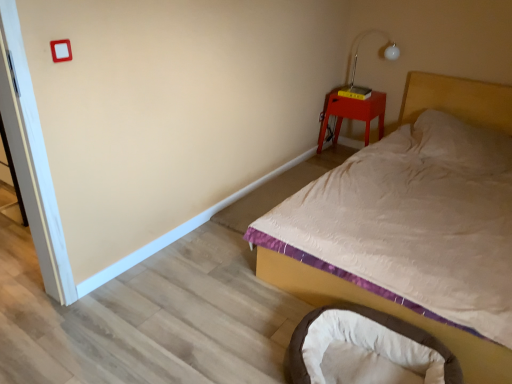
Question: From the image's perspective, is metallic silver table lamp at upper right on matte red wooden nightstand at upper right?

Choices:
 (A) no
 (B) yes

Answer: (B)

Question: From a real-world perspective, is metallic silver table lamp at upper right below matte red wooden nightstand at upper right?

Choices:
 (A) no
 (B) yes

Answer: (A)

Question: Does metallic silver table lamp at upper right have a smaller size compared to matte red wooden nightstand at upper right?

Choices:
 (A) yes
 (B) no

Answer: (A)

Question: Is metallic silver table lamp at upper right positioned in front of matte red wooden nightstand at upper right?

Choices:
 (A) yes
 (B) no

Answer: (A)

Question: Can you confirm if metallic silver table lamp at upper right is taller than matte red wooden nightstand at upper right?

Choices:
 (A) yes
 (B) no

Answer: (B)

Question: Is metallic silver table lamp at upper right taller or shorter than white quilted fabric bed at upper right?

Choices:
 (A) short
 (B) tall

Answer: (A)

Question: Does point (379, 33) appear closer or farther from the camera than point (501, 122)?

Choices:
 (A) closer
 (B) farther

Answer: (B)

Question: From a real-world perspective, is metallic silver table lamp at upper right physically located above or below white quilted fabric bed at upper right?

Choices:
 (A) below
 (B) above

Answer: (B)

Question: Would you say metallic silver table lamp at upper right is inside or outside white quilted fabric bed at upper right?

Choices:
 (A) outside
 (B) inside

Answer: (A)

Question: Is brown plush infant bed at lower right situated inside white quilted fabric bed at upper right or outside?

Choices:
 (A) outside
 (B) inside

Answer: (A)

Question: From the image's perspective, is brown plush infant bed at lower right positioned above or below white quilted fabric bed at upper right?

Choices:
 (A) above
 (B) below

Answer: (B)

Question: In terms of width, does brown plush infant bed at lower right look wider or thinner when compared to white quilted fabric bed at upper right?

Choices:
 (A) thin
 (B) wide

Answer: (A)

Question: Is brown plush infant bed at lower right in front of or behind white quilted fabric bed at upper right in the image?

Choices:
 (A) behind
 (B) front

Answer: (B)

Question: In terms of height, does matte red wooden nightstand at upper right look taller or shorter compared to white quilted fabric bed at upper right?

Choices:
 (A) short
 (B) tall

Answer: (A)

Question: Is matte red wooden nightstand at upper right spatially inside white quilted fabric bed at upper right, or outside of it?

Choices:
 (A) outside
 (B) inside

Answer: (A)